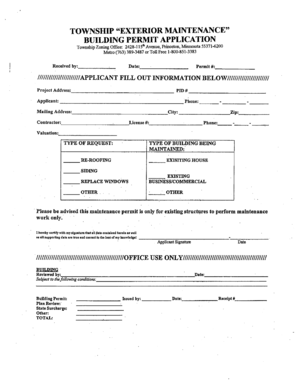
Where is `office`? The image size is (297, 386). office is located at coordinates click(x=131, y=258).